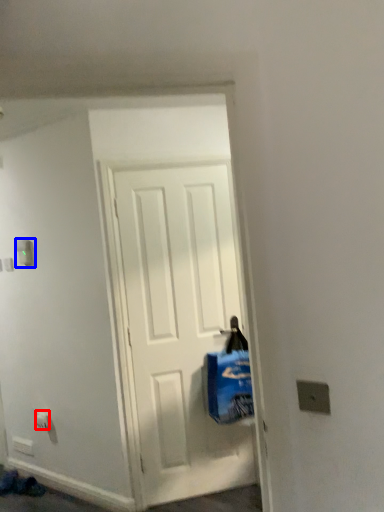
Question: Which object is further to the camera taking this photo, electric outlet (highlighted by a red box) or light switch (highlighted by a blue box)?

Choices:
 (A) electric outlet
 (B) light switch

Answer: (A)